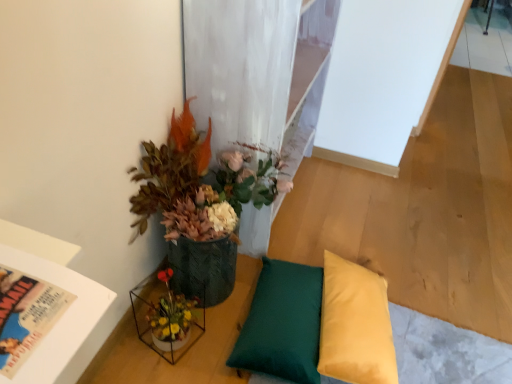
Question: From a real-world perspective, is yellow fabric pillow at lower right, which is the second pillow in left-to-right order, located beneath green fabric pillow at lower center, the 1th pillow when ordered from left to right?

Choices:
 (A) yes
 (B) no

Answer: (B)

Question: Can you confirm if yellow fabric pillow at lower right, acting as the 1th pillow starting from the right, is thinner than green fabric pillow at lower center, marked as the second pillow in a right-to-left arrangement?

Choices:
 (A) no
 (B) yes

Answer: (A)

Question: Does yellow fabric pillow at lower right, which is the second pillow in left-to-right order, have a greater width compared to green fabric pillow at lower center, the 1th pillow when ordered from left to right?

Choices:
 (A) no
 (B) yes

Answer: (B)

Question: Considering the relative sizes of yellow fabric pillow at lower right, which is the second pillow in left-to-right order, and green fabric pillow at lower center, marked as the second pillow in a right-to-left arrangement, in the image provided, is yellow fabric pillow at lower right, which is the second pillow in left-to-right order, bigger than green fabric pillow at lower center, marked as the second pillow in a right-to-left arrangement,?

Choices:
 (A) yes
 (B) no

Answer: (A)

Question: Does yellow fabric pillow at lower right, which is the second pillow in left-to-right order, have a smaller size compared to green fabric pillow at lower center, marked as the second pillow in a right-to-left arrangement?

Choices:
 (A) no
 (B) yes

Answer: (A)

Question: From the image's perspective, is translucent glass vase at lower left positioned above or below yellow fabric pillow at lower right, which is the second pillow in left-to-right order?

Choices:
 (A) below
 (B) above

Answer: (B)

Question: Based on their positions, is translucent glass vase at lower left located to the left or right of yellow fabric pillow at lower right, which is the second pillow in left-to-right order?

Choices:
 (A) right
 (B) left

Answer: (B)

Question: Which is correct: translucent glass vase at lower left is inside yellow fabric pillow at lower right, acting as the 1th pillow starting from the right, or outside of it?

Choices:
 (A) inside
 (B) outside

Answer: (B)

Question: Does point (148, 276) appear closer or farther from the camera than point (353, 375)?

Choices:
 (A) farther
 (B) closer

Answer: (A)

Question: Is textured green pot at upper left inside the boundaries of yellow fabric pillow at lower right, which is the second pillow in left-to-right order, or outside?

Choices:
 (A) inside
 (B) outside

Answer: (B)

Question: Considering the relative positions of textured green pot at upper left and yellow fabric pillow at lower right, acting as the 1th pillow starting from the right, in the image provided, is textured green pot at upper left to the left or to the right of yellow fabric pillow at lower right, acting as the 1th pillow starting from the right,?

Choices:
 (A) left
 (B) right

Answer: (A)

Question: From their relative heights in the image, would you say textured green pot at upper left is taller or shorter than yellow fabric pillow at lower right, acting as the 1th pillow starting from the right?

Choices:
 (A) short
 (B) tall

Answer: (B)

Question: Does point (159, 162) appear closer or farther from the camera than point (322, 370)?

Choices:
 (A) farther
 (B) closer

Answer: (A)

Question: In the image, is green fabric pillow at lower center, the 1th pillow when ordered from left to right, on the left side or the right side of translucent glass vase at lower left?

Choices:
 (A) left
 (B) right

Answer: (B)

Question: Looking at their shapes, would you say green fabric pillow at lower center, the 1th pillow when ordered from left to right, is wider or thinner than translucent glass vase at lower left?

Choices:
 (A) wide
 (B) thin

Answer: (A)